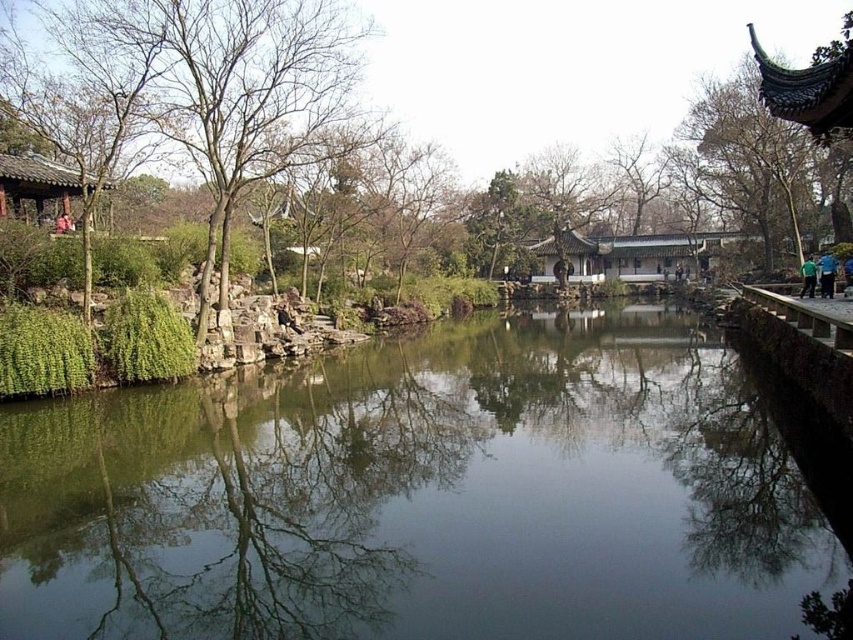
Based on the photo, which is more to the left, green stone river at center or green leafy tree at left?

green stone river at center

Is green stone river at center smaller than green leafy tree at left?

Yes.

Is point (605, 426) farther from viewer compared to point (590, 54)?

No, it is in front of (590, 54).

The width and height of the screenshot is (853, 640). Identify the location of green stone river at center. (424, 496).